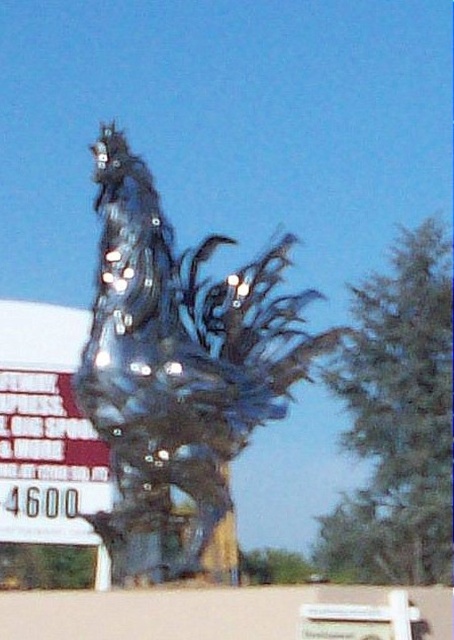
You are standing at the base of the large metallic sculpture and want to take a photo of the glossy glass rooster at center. If your camera has a maximum zoom range of 100 meters, will you be able to capture the rooster clearly without moving closer?

The glossy glass rooster at center is 36.83 meters away from the camera. Since the camera can zoom up to 100 meters, you can capture the rooster clearly without moving closer.